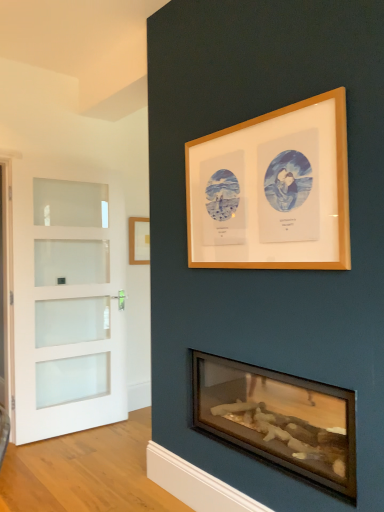
Question: Is white frosted glass door at left to the right of wooden picture frame at upper center, acting as the 2th picture frame starting from the back, from the viewer's perspective?

Choices:
 (A) no
 (B) yes

Answer: (A)

Question: From a real-world perspective, is white frosted glass door at left positioned over wooden picture frame at upper center, the first picture frame when ordered from right to left, based on gravity?

Choices:
 (A) yes
 (B) no

Answer: (B)

Question: Is white frosted glass door at left at the left side of wooden picture frame at upper center, marked as the 1th picture frame in a front-to-back arrangement?

Choices:
 (A) yes
 (B) no

Answer: (A)

Question: From the image's perspective, does white frosted glass door at left appear higher than wooden picture frame at upper center, acting as the 2th picture frame starting from the back?

Choices:
 (A) no
 (B) yes

Answer: (A)

Question: Considering the relative sizes of white frosted glass door at left and wooden picture frame at upper center, marked as the second picture frame in a left-to-right arrangement, in the image provided, is white frosted glass door at left smaller than wooden picture frame at upper center, marked as the second picture frame in a left-to-right arrangement,?

Choices:
 (A) no
 (B) yes

Answer: (A)

Question: Considering the relative positions of wooden picture frame at center, the second picture frame from the front, and wooden picture frame at upper center, the first picture frame when ordered from right to left, in the image provided, is wooden picture frame at center, the second picture frame from the front, to the left or to the right of wooden picture frame at upper center, the first picture frame when ordered from right to left,?

Choices:
 (A) left
 (B) right

Answer: (A)

Question: Considering the positions of point (147, 247) and point (317, 130), is point (147, 247) closer or farther from the camera than point (317, 130)?

Choices:
 (A) farther
 (B) closer

Answer: (A)

Question: In terms of size, does wooden picture frame at center, the first picture frame when ordered from left to right, appear bigger or smaller than wooden picture frame at upper center, marked as the second picture frame in a left-to-right arrangement?

Choices:
 (A) big
 (B) small

Answer: (B)

Question: From their relative heights in the image, would you say wooden picture frame at center, the second picture frame in the right-to-left sequence, is taller or shorter than wooden picture frame at upper center, marked as the second picture frame in a left-to-right arrangement?

Choices:
 (A) short
 (B) tall

Answer: (A)

Question: From the image's perspective, relative to wooden picture frame at center, the first picture frame when ordered from left to right, is wooden logs at lower center above or below?

Choices:
 (A) above
 (B) below

Answer: (B)

Question: In the image, is wooden logs at lower center positioned in front of or behind wooden picture frame at center, which appears as the 1th picture frame when viewed from the back?

Choices:
 (A) front
 (B) behind

Answer: (A)

Question: From a real-world perspective, relative to wooden picture frame at center, which appears as the 1th picture frame when viewed from the back, is wooden logs at lower center vertically above or below?

Choices:
 (A) below
 (B) above

Answer: (A)

Question: Is point pyautogui.click(x=322, y=386) positioned closer to the camera than point pyautogui.click(x=147, y=258)?

Choices:
 (A) farther
 (B) closer

Answer: (B)

Question: From a real-world perspective, is white frosted glass door at left above or below wooden picture frame at upper center, acting as the 2th picture frame starting from the back?

Choices:
 (A) above
 (B) below

Answer: (B)

Question: Considering the positions of white frosted glass door at left and wooden picture frame at upper center, marked as the second picture frame in a left-to-right arrangement, in the image, is white frosted glass door at left bigger or smaller than wooden picture frame at upper center, marked as the second picture frame in a left-to-right arrangement,?

Choices:
 (A) small
 (B) big

Answer: (B)